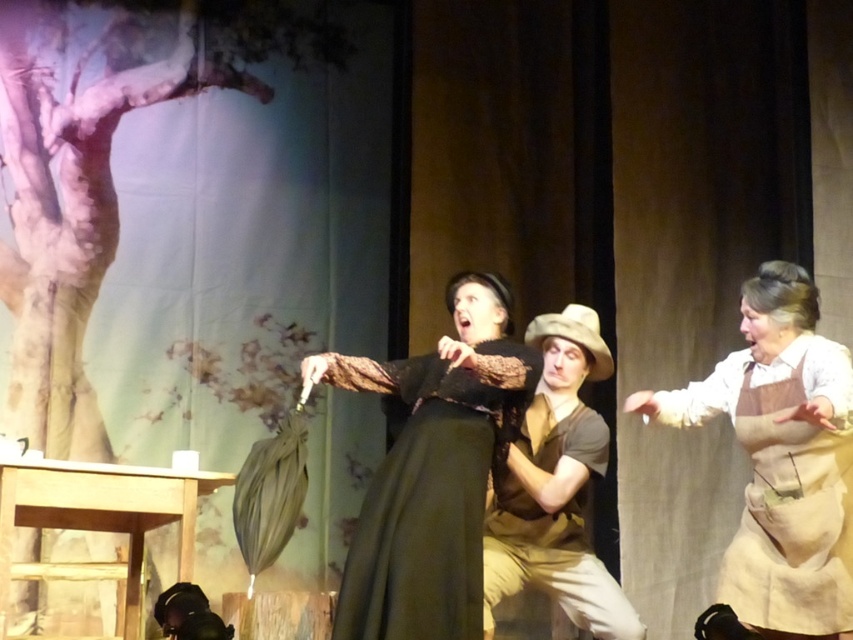
Is the position of matte black dress at center more distant than that of brown cotton apron at center?

No.

What do you see at coordinates (433, 470) in the screenshot? I see `matte black dress at center` at bounding box center [433, 470].

Is point (498, 308) farther from viewer compared to point (751, 577)?

Yes, point (498, 308) is farther from viewer.

The width and height of the screenshot is (853, 640). What are the coordinates of `matte black dress at center` in the screenshot? It's located at (433, 470).

Which is above, brown cotton apron at center or brown cotton shirt at center?

Positioned higher is brown cotton apron at center.

Is brown cotton apron at center bigger than brown cotton shirt at center?

Indeed, brown cotton apron at center has a larger size compared to brown cotton shirt at center.

Between point (751, 324) and point (509, 572), which one is positioned behind?

Point (509, 572)

This screenshot has height=640, width=853. Identify the location of brown cotton apron at center. (781, 460).

Which is more to the right, matte black dress at center or brown cotton shirt at center?

Positioned to the right is brown cotton shirt at center.

Between matte black dress at center and brown cotton shirt at center, which one appears on the left side from the viewer's perspective?

Positioned to the left is matte black dress at center.

Measure the distance between point (358, 376) and camera.

Point (358, 376) is 10.25 feet from camera.

Where is `matte black dress at center`? The image size is (853, 640). matte black dress at center is located at coordinates (433, 470).